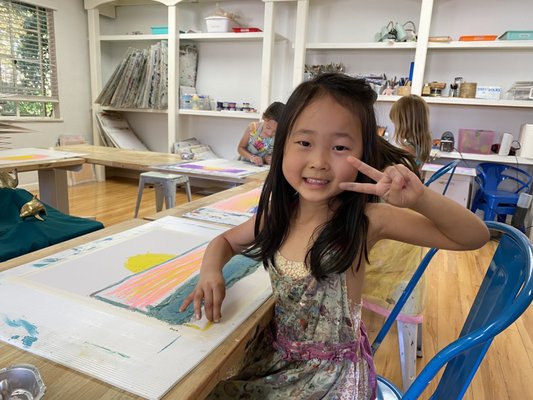
Image resolution: width=533 pixels, height=400 pixels. Identify the location of blinds. (30, 59).